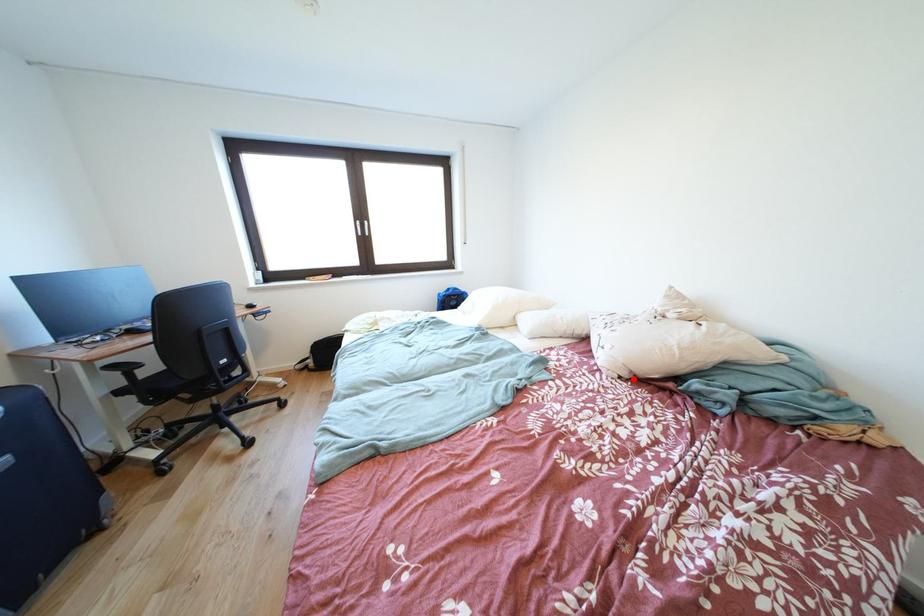
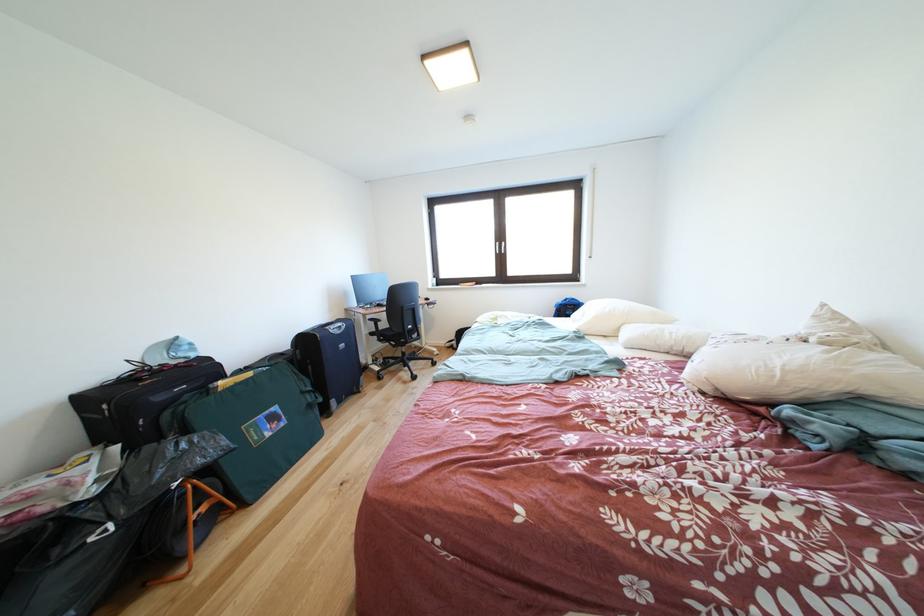
Question: I am providing you with two images of the same scene from different viewpoints. A red point is marked on the first image. At the location where the point appears in image 1, is it still visible in image 2?

Choices:
 (A) Yes
 (B) No

Answer: (A)